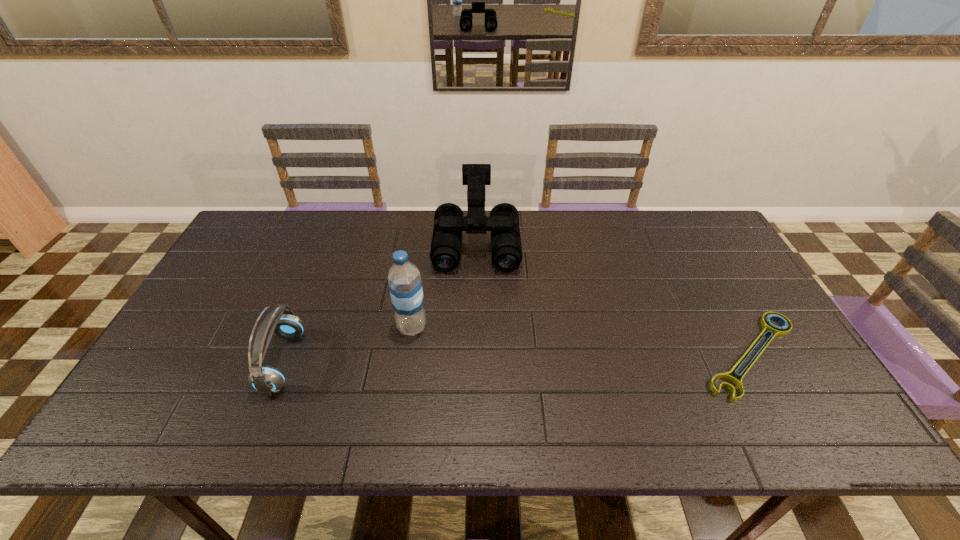
The width and height of the screenshot is (960, 540). I want to click on free location located on the left of the rightmost object, so click(553, 355).

Locate an element on the screen. This screenshot has width=960, height=540. blank area located 0.300m on the label of the tallest object is located at coordinates (525, 384).

Where is `free space located 0.130m on the label of the tallest object`? The height and width of the screenshot is (540, 960). free space located 0.130m on the label of the tallest object is located at coordinates (466, 354).

Where is `vacant region located on the label of the tallest object`? This screenshot has width=960, height=540. vacant region located on the label of the tallest object is located at coordinates pyautogui.click(x=529, y=386).

In order to click on blank space located on the front lenses of the binoculars in this screenshot , I will do `click(476, 312)`.

Where is `vacant area situated on the front lenses of the binoculars`? vacant area situated on the front lenses of the binoculars is located at coordinates (476, 309).

You are a GUI agent. You are given a task and a screenshot of the screen. Output one action in this format:
    pyautogui.click(x=<x>, y=<y>)
    Task: Click on the vacant area situated on the front lenses of the binoculars
    The image size is (960, 540).
    Given the screenshot: What is the action you would take?
    (476, 303)

Locate an element on the screen. The height and width of the screenshot is (540, 960). object positioned at the far edge is located at coordinates (506, 249).

You are a GUI agent. You are given a task and a screenshot of the screen. Output one action in this format:
    pyautogui.click(x=<x>, y=<y>)
    Task: Click on the headset located at the near edge
    This screenshot has height=540, width=960.
    Given the screenshot: What is the action you would take?
    pyautogui.click(x=265, y=379)

Locate an element on the screen. This screenshot has width=960, height=540. wrench that is positioned at the near edge is located at coordinates (771, 329).